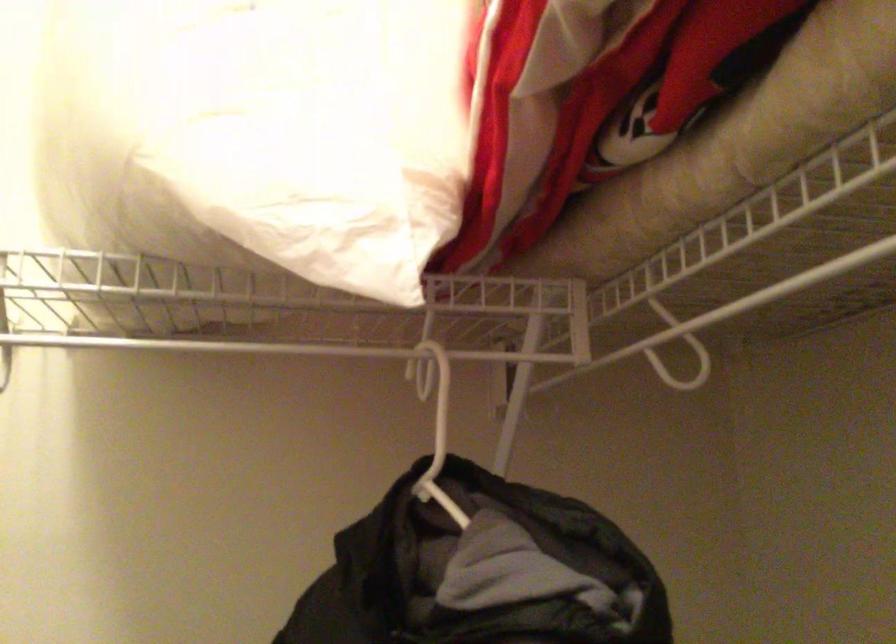
What do you see at coordinates (677, 354) in the screenshot? This screenshot has width=896, height=644. I see `the white shelf hook` at bounding box center [677, 354].